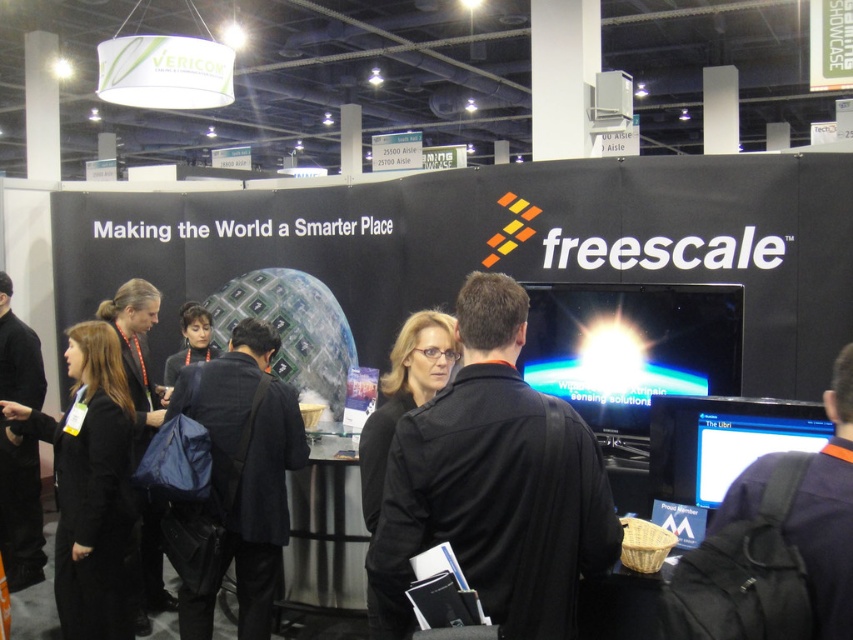
Is black fabric at center to the right of black fabric coat at center from the viewer's perspective?

Indeed, black fabric at center is positioned on the right side of black fabric coat at center.

Can you confirm if black fabric at center is thinner than black fabric coat at center?

No, black fabric at center is not thinner than black fabric coat at center.

In the scene shown: Who is more forward, [517,481] or [106,632]?

Point [517,481] is more forward.

This screenshot has height=640, width=853. Find the location of `black fabric at center`. black fabric at center is located at coordinates (492, 484).

Measure the distance between point (199, 378) and camera.

2.98 meters

Between point (306, 452) and point (126, 593), which one is positioned in front?

Positioned in front is point (306, 452).

Locate an element on the screen. black fabric jacket at center is located at coordinates (247, 461).

Is black fabric at center closer to the viewer compared to black fabric jacket at center?

Yes.

Who is shorter, black fabric at center or black fabric jacket at center?

With less height is black fabric at center.

Between point (479, 289) and point (238, 545), which one is positioned behind?

Point (238, 545)

You are a GUI agent. You are given a task and a screenshot of the screen. Output one action in this format:
    pyautogui.click(x=<x>, y=<y>)
    Task: Click on the black fabric at center
    
    Given the screenshot: What is the action you would take?
    pyautogui.click(x=492, y=484)